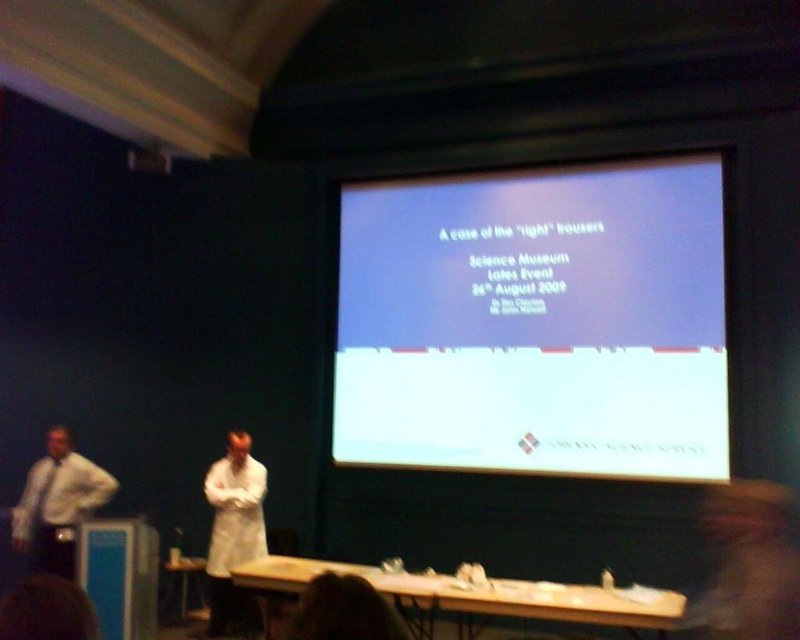
Who is taller, white matte projection screen at upper center or white shirt at left?

With more height is white matte projection screen at upper center.

Can you confirm if white matte projection screen at upper center is thinner than white shirt at left?

No, white matte projection screen at upper center is not thinner than white shirt at left.

Identify the location of white matte projection screen at upper center. The image size is (800, 640). (536, 321).

This screenshot has width=800, height=640. What are the coordinates of `white matte projection screen at upper center` in the screenshot? It's located at (536, 321).

Which is in front, point (686, 196) or point (226, 484)?

Positioned in front is point (226, 484).

Is white matte projection screen at upper center further to camera compared to white lab coat at center?

Yes, it is behind white lab coat at center.

What do you see at coordinates (536, 321) in the screenshot? This screenshot has width=800, height=640. I see `white matte projection screen at upper center` at bounding box center [536, 321].

The image size is (800, 640). In order to click on white matte projection screen at upper center in this screenshot , I will do `click(536, 321)`.

Does white lab coat at center lie in front of white shirt at left?

That is False.

Which of these two, white lab coat at center or white shirt at left, stands shorter?

With less height is white shirt at left.

Where is `white lab coat at center`? Image resolution: width=800 pixels, height=640 pixels. white lab coat at center is located at coordinates (234, 532).